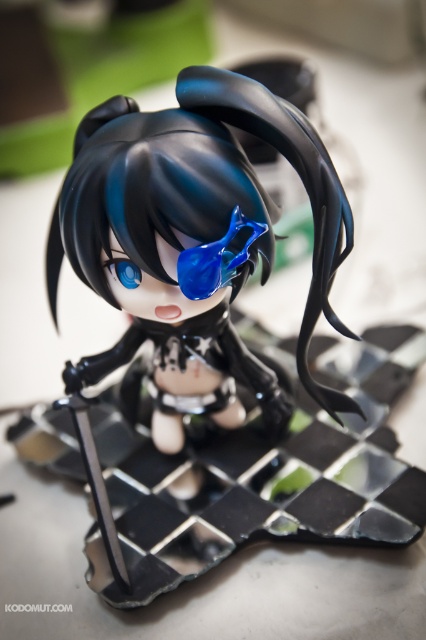
Question: Does satin black hair at center come in front of transparent blue goggles at center?

Choices:
 (A) no
 (B) yes

Answer: (B)

Question: Which object is closer to the camera taking this photo?

Choices:
 (A) satin black hair at center
 (B) transparent blue goggles at center

Answer: (A)

Question: Can you confirm if satin black hair at center is smaller than transparent blue goggles at center?

Choices:
 (A) no
 (B) yes

Answer: (A)

Question: Among these objects, which one is nearest to the camera?

Choices:
 (A) transparent blue goggles at center
 (B) satin black hair at center

Answer: (B)

Question: Can you confirm if satin black hair at center is smaller than transparent blue goggles at center?

Choices:
 (A) yes
 (B) no

Answer: (B)